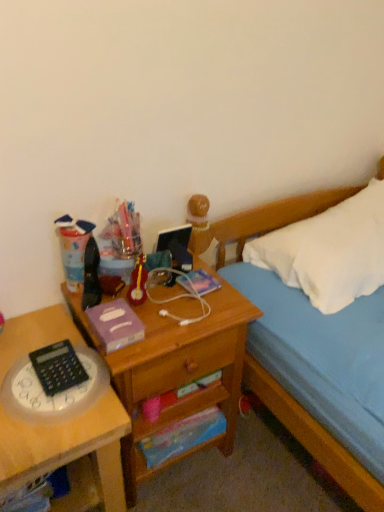
I want to click on free space above translucent plastic clock at left, which appears as the 2th desk when viewed from the right (from a real-world perspective), so click(32, 380).